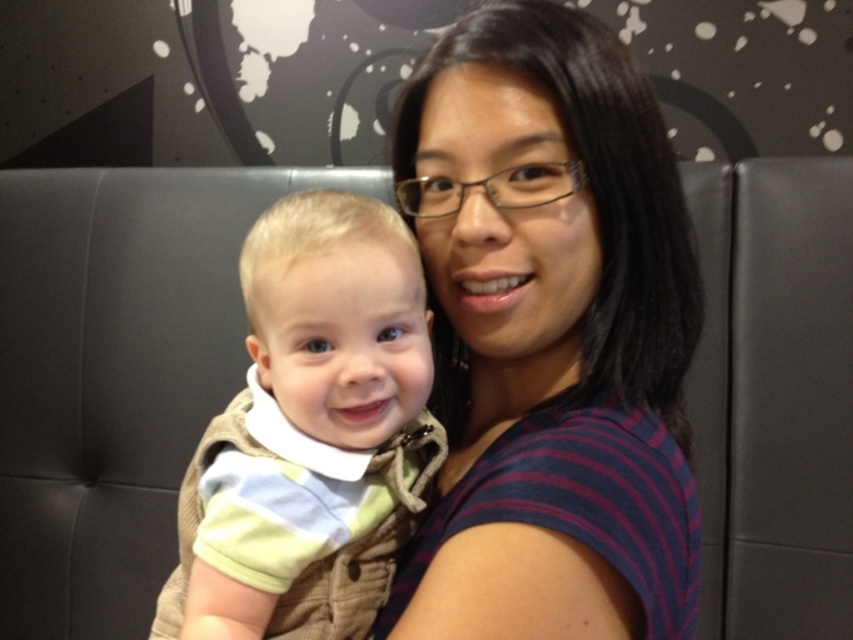
Is striped fabric shirt at center to the left of striped fabric baby at left from the viewer's perspective?

Incorrect, striped fabric shirt at center is not on the left side of striped fabric baby at left.

Measure the distance between striped fabric shirt at center and camera.

striped fabric shirt at center is 17.43 inches from camera.

Who is more distant from viewer, (x=479, y=448) or (x=254, y=636)?

The point (x=479, y=448) is more distant.

At what (x,y) coordinates should I click in order to perform the action: click on striped fabric shirt at center. Please return your answer as a coordinate pair (x, y). The image size is (853, 640). Looking at the image, I should click on (556, 330).